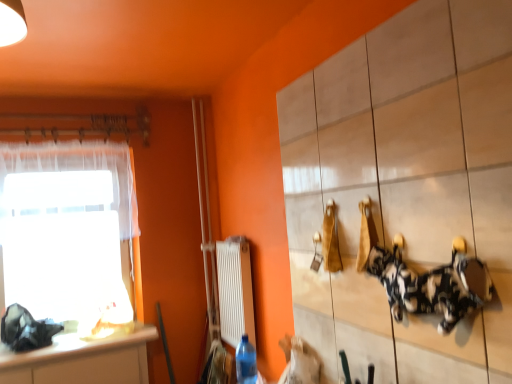
Question: Is the depth of white tile cabinet at upper right greater than that of blue plastic bottle at lower center?

Choices:
 (A) yes
 (B) no

Answer: (B)

Question: Can you confirm if white tile cabinet at upper right is taller than blue plastic bottle at lower center?

Choices:
 (A) yes
 (B) no

Answer: (A)

Question: Is white tile cabinet at upper right to the left of blue plastic bottle at lower center from the viewer's perspective?

Choices:
 (A) no
 (B) yes

Answer: (A)

Question: From the image's perspective, is white tile cabinet at upper right over blue plastic bottle at lower center?

Choices:
 (A) yes
 (B) no

Answer: (A)

Question: From a real-world perspective, is white tile cabinet at upper right positioned under blue plastic bottle at lower center based on gravity?

Choices:
 (A) no
 (B) yes

Answer: (A)

Question: Considering the positions of blue plastic bottle at lower center and transparent fabric at left in the image, is blue plastic bottle at lower center taller or shorter than transparent fabric at left?

Choices:
 (A) short
 (B) tall

Answer: (A)

Question: From a real-world perspective, is blue plastic bottle at lower center above or below transparent fabric at left?

Choices:
 (A) below
 (B) above

Answer: (A)

Question: Looking at the image, does blue plastic bottle at lower center seem bigger or smaller compared to transparent fabric at left?

Choices:
 (A) small
 (B) big

Answer: (A)

Question: Is point (251, 352) closer or farther from the camera than point (87, 324)?

Choices:
 (A) farther
 (B) closer

Answer: (B)

Question: In terms of height, does white glossy countertop at lower left look taller or shorter compared to white plastic radiator at center?

Choices:
 (A) tall
 (B) short

Answer: (B)

Question: Is white glossy countertop at lower left inside or outside of white plastic radiator at center?

Choices:
 (A) inside
 (B) outside

Answer: (B)

Question: Does point (138, 380) appear closer or farther from the camera than point (232, 319)?

Choices:
 (A) farther
 (B) closer

Answer: (A)

Question: Is white glossy countertop at lower left to the left or to the right of white plastic radiator at center in the image?

Choices:
 (A) right
 (B) left

Answer: (B)

Question: Does point (501, 122) appear closer or farther from the camera than point (45, 375)?

Choices:
 (A) closer
 (B) farther

Answer: (A)

Question: Considering the relative positions of white tile cabinet at upper right and white glossy countertop at lower left in the image provided, is white tile cabinet at upper right to the left or to the right of white glossy countertop at lower left?

Choices:
 (A) left
 (B) right

Answer: (B)